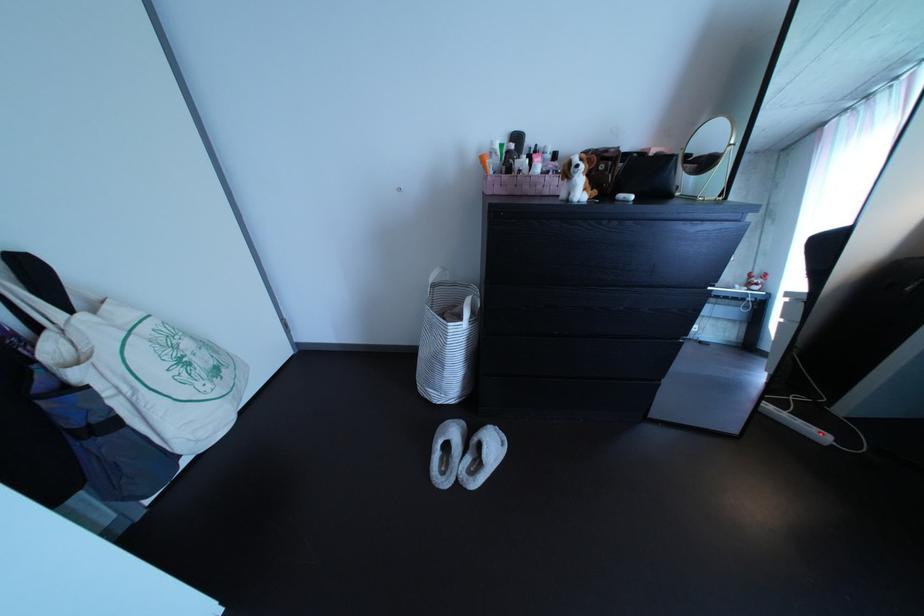
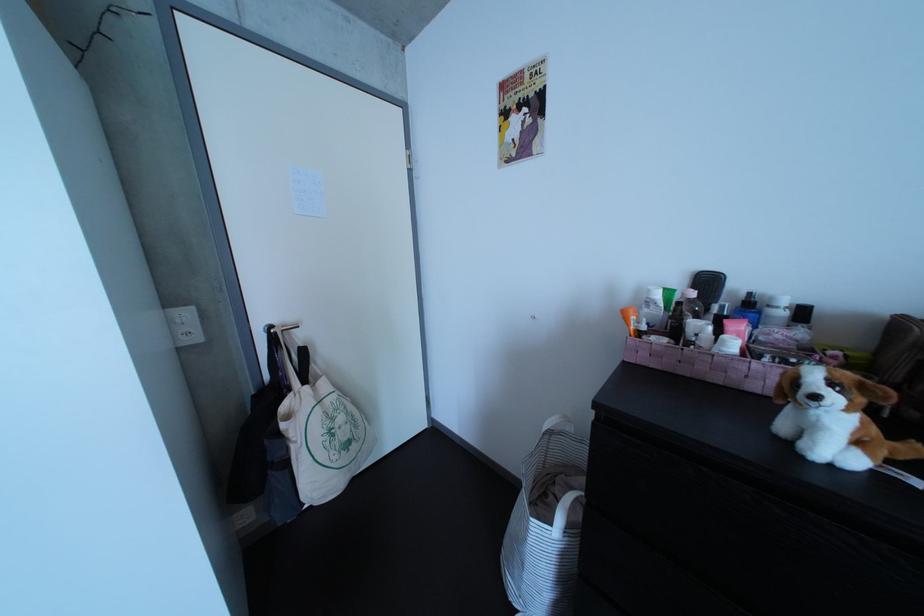
In the second image, find the point that corresponds to (464,331) in the first image.

(545, 527)